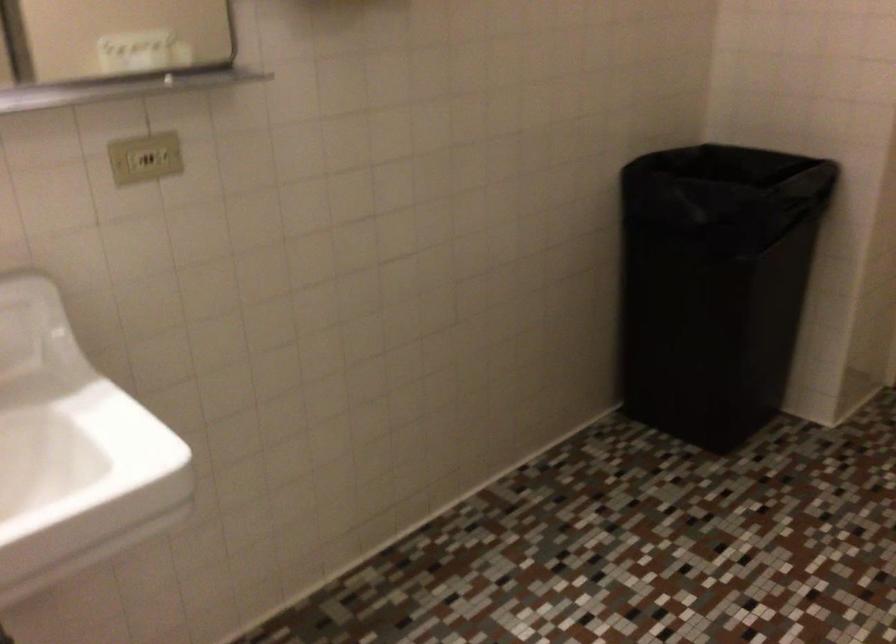
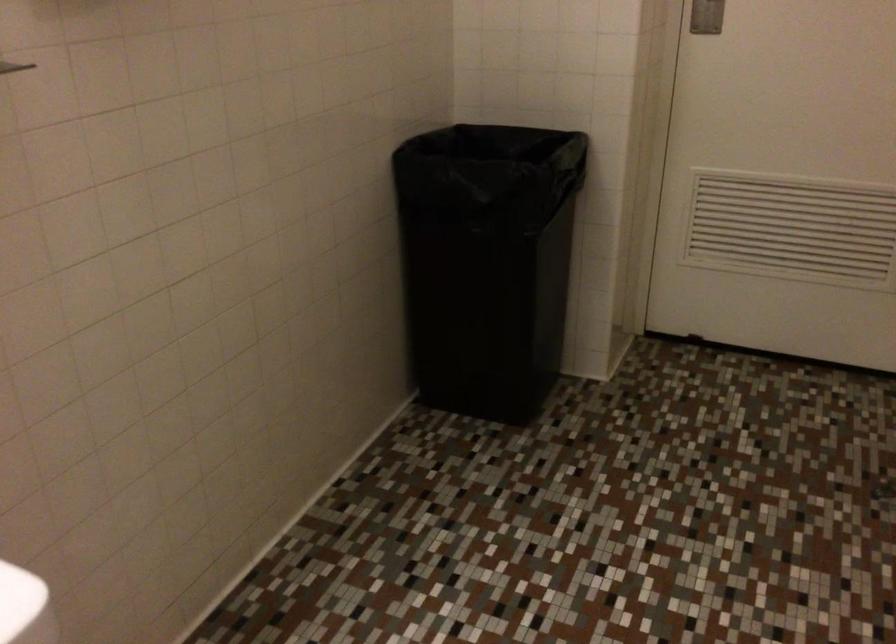
Question: The camera is either moving clockwise (left) or counter-clockwise (right) around the object. The first image is from the beginning of the video and the second image is from the end. Is the camera moving left or right when shooting the video?

Choices:
 (A) Left
 (B) Right

Answer: (A)